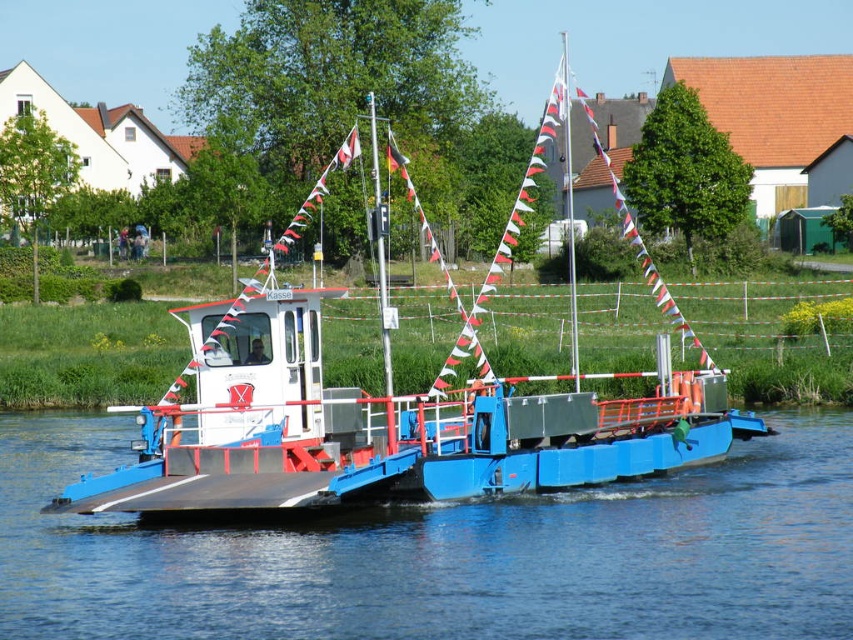
Does blue metallic river at center lie behind blue matte ferryboat at center?

That is False.

What do you see at coordinates (445, 554) in the screenshot? The width and height of the screenshot is (853, 640). I see `blue metallic river at center` at bounding box center [445, 554].

I want to click on blue metallic river at center, so click(x=445, y=554).